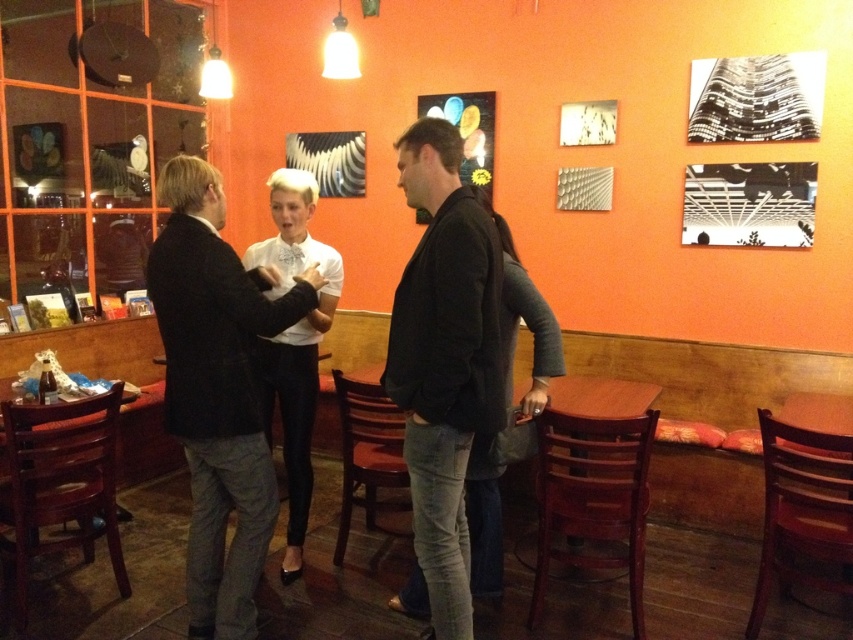
You are a server in this cafe and need to place a large tray of food on the table. Considering the size of the black matte jacket at center and the wooden table at center, will there be enough space on the table to place the tray?

The black matte jacket at center has a larger size compared to wooden table at center. This means the wooden table at center may not have sufficient space to accommodate the large tray, as the jacket already occupies a significant portion of the table.

You are a photographer standing in the same room and want to take a photo that includes both the black matte jacket at center and the white shirt at center. Considering their distance, can you fit both into your camera frame without moving closer or farther away?

The black matte jacket at center and white shirt at center are 29.66 inches apart from each other. Assuming an average camera frame width of about 36 inches at typical shooting distances, both subjects can likely be captured in the same frame without needing to adjust your position.

You are a photographer positioned at the front of the scene. You want to take a photo that includes both the black matte jacket at center and the white shirt at center. Which object should you focus on first to ensure both are in sharp focus?

The black matte jacket at center is closer to the viewer than the white shirt at center. To ensure both are in sharp focus, you should focus on the black matte jacket at center first, as it is closer, and the white shirt at center will fall within the depth of field.